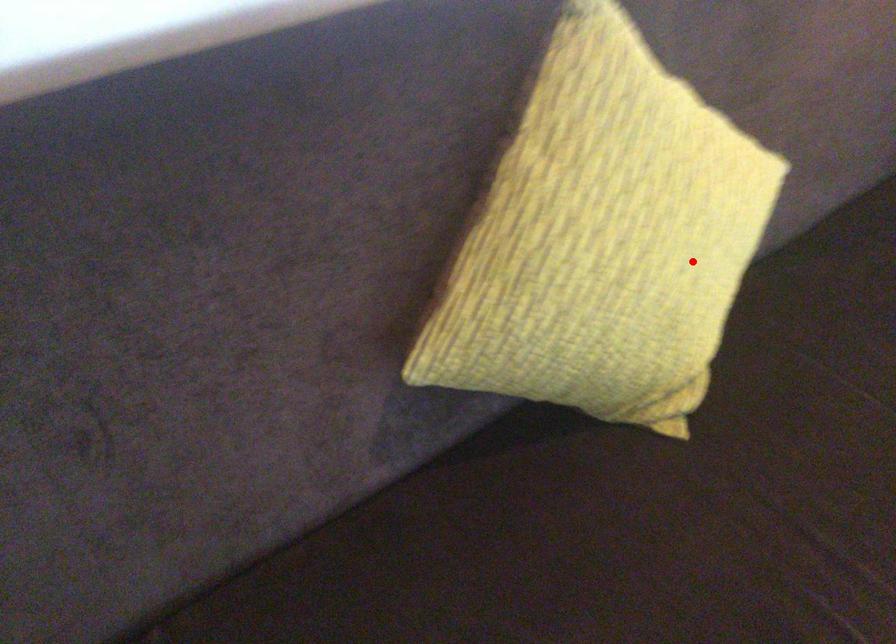
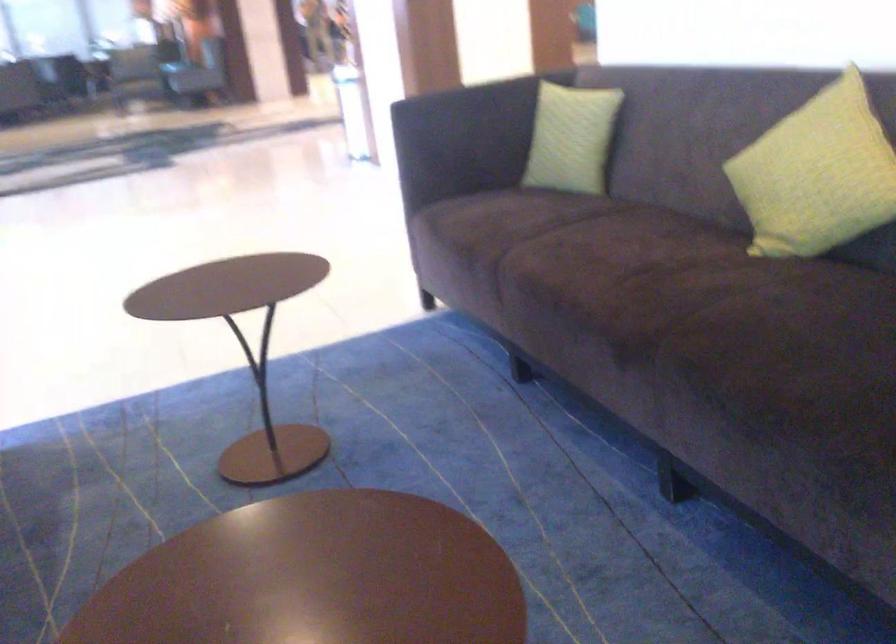
Question: I am providing you with two images of the same scene from different viewpoints. In image1, a red point is highlighted. Considering the same 3D point in image2, which of the following is correct?

Choices:
 (A) It is closer
 (B) It is farther

Answer: (B)